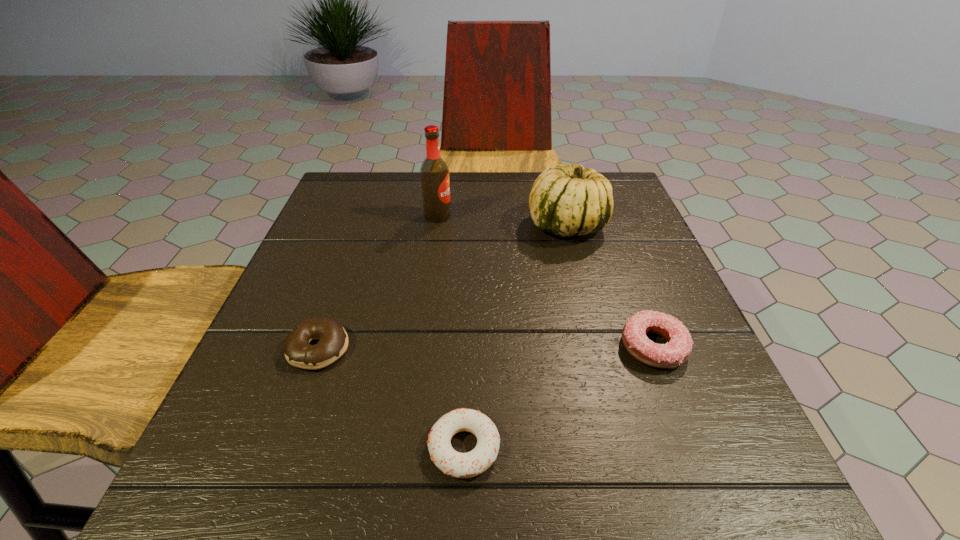
Where is `vacant space at the right edge of the desktop`? Image resolution: width=960 pixels, height=540 pixels. vacant space at the right edge of the desktop is located at coordinates (607, 299).

You are a GUI agent. You are given a task and a screenshot of the screen. Output one action in this format:
    pyautogui.click(x=<x>, y=<y>)
    Task: Click on the vacant space at the near left corner
    
    Given the screenshot: What is the action you would take?
    pyautogui.click(x=252, y=509)

In the image, there is a desktop. What are the coordinates of `vacant space at the far right corner` in the screenshot? It's located at (616, 207).

Locate an element on the screen. free space between the shortest doughnut and the rightmost doughnut is located at coordinates (559, 397).

Find the location of a particular element. vacant point located between the gourd and the nearest doughnut is located at coordinates (516, 336).

At what (x,y) coordinates should I click in order to perform the action: click on free space between the second doughnut from right to left and the leftmost doughnut. Please return your answer as a coordinate pair (x, y). Looking at the image, I should click on (392, 398).

Locate an element on the screen. Image resolution: width=960 pixels, height=540 pixels. free area in between the rightmost doughnut and the tallest object is located at coordinates (545, 281).

At what (x,y) coordinates should I click in order to perform the action: click on free space between the beer bottle and the fourth shortest object. Please return your answer as a coordinate pair (x, y). This screenshot has width=960, height=540. Looking at the image, I should click on (502, 220).

Where is `vacant space in between the rightmost doughnut and the leftmost object`? This screenshot has height=540, width=960. vacant space in between the rightmost doughnut and the leftmost object is located at coordinates (487, 348).

Find the location of a particular element. The height and width of the screenshot is (540, 960). free area in between the nearest object and the leftmost object is located at coordinates [392, 398].